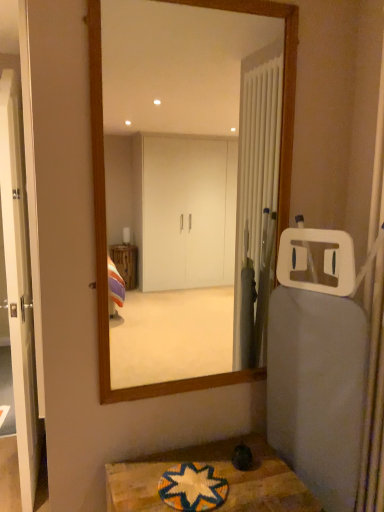
Image resolution: width=384 pixels, height=512 pixels. Identify the location of vacant point to the left of multicolored woven mat at lower center. (130, 489).